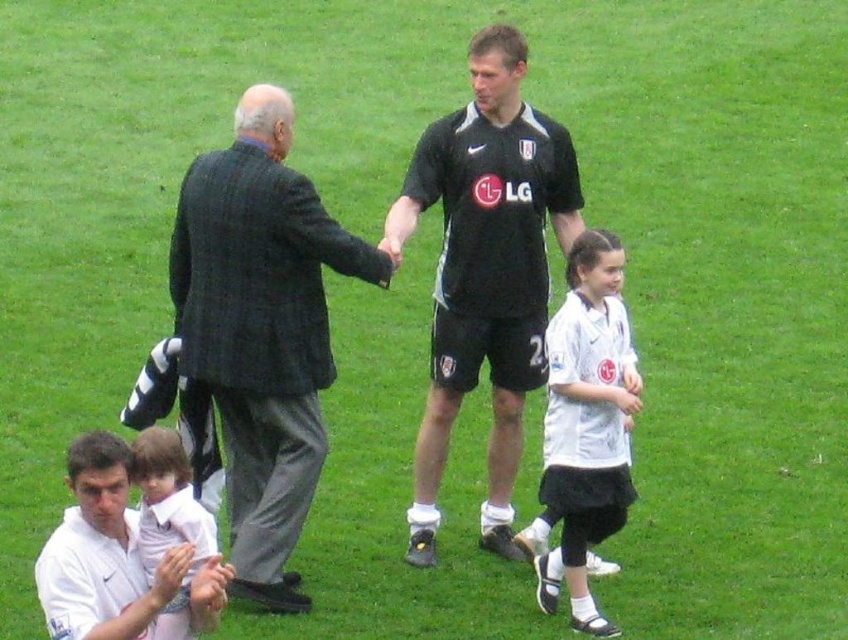
You are a photographer trying to capture a group photo of the dark gray textured suit at left and the white jersey at center. Given that your camera can only focus on objects within a 2 meter width, will both subjects fit in the frame?

The dark gray textured suit at left is wider than the white jersey at center. However, since the camera can focus on objects within a 2 meter width, both subjects will fit in the frame as long as their combined width does not exceed 2 meters. However, the exact measurement isn

Based on the photo, you are an observer standing in the grassy field. You see the white jersey at center and the light pink fabric at lower left. Which object is wider?

The white jersey at center is wider than the light pink fabric at lower left.